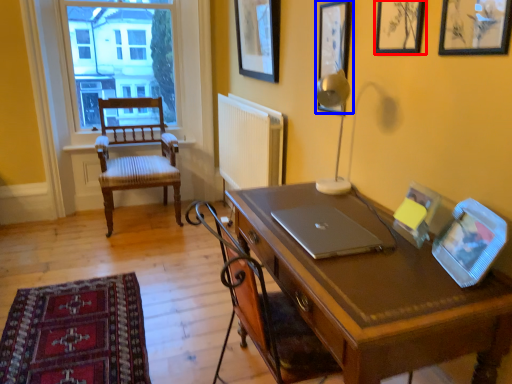
Question: Which point is further to the camera, picture frame (highlighted by a red box) or picture frame (highlighted by a blue box)?

Choices:
 (A) picture frame
 (B) picture frame

Answer: (B)